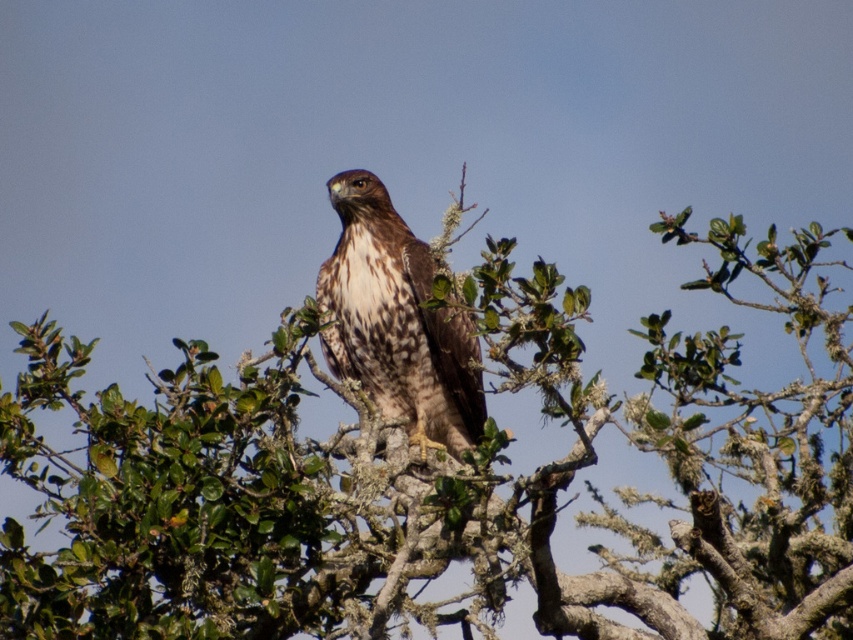
You are a birdwatcher trying to determine the relative sizes of two subjects in the image. Based on the scene, can you compare the width of the green leafy tree at center and the brown speckled eagle at center?

The green leafy tree at center is wider than the brown speckled eagle at center according to the description.

You are standing in a forest clearing and see the green leafy tree at center and the brown speckled eagle at center. Which object is closer to you?

The green leafy tree at center is closer to you because it is positioned in front of the brown speckled eagle at center.

You are a birdwatcher observing the scene. You notice the green leafy tree at center and the brown speckled eagle at center. Which object is taller?

The green leafy tree at center is taller than the brown speckled eagle at center according to the description.